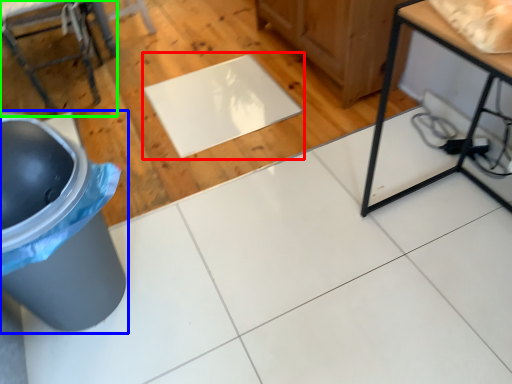
Question: Which object is the farthest from mat (highlighted by a red box)? Choose among these: waste container (highlighted by a blue box) or furniture (highlighted by a green box).

Choices:
 (A) waste container
 (B) furniture

Answer: (A)